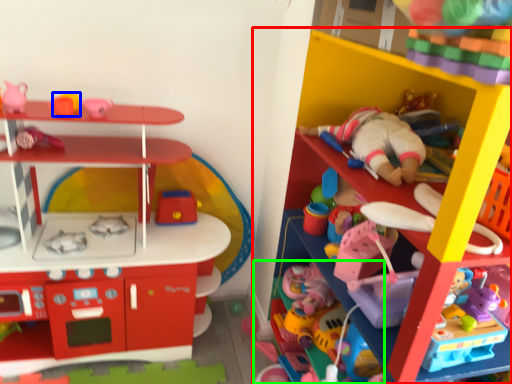
Question: Which object is positioned closest to shelf (highlighted by a red box)? Select from toy (highlighted by a blue box) and toy (highlighted by a green box).

Choices:
 (A) toy
 (B) toy

Answer: (B)